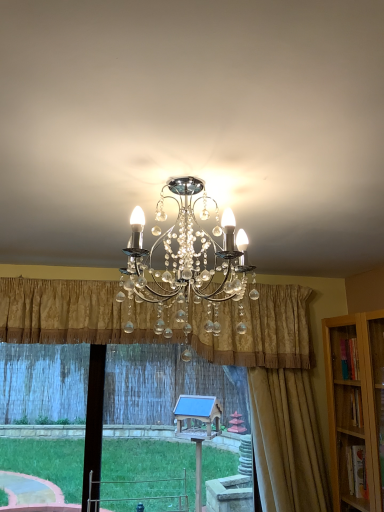
From the picture: In order to face transparent glass window at center, should I rotate leftwards or rightwards?

It's best to rotate left around 1.421 degrees.

This screenshot has height=512, width=384. What do you see at coordinates (167, 385) in the screenshot? I see `transparent glass window at center` at bounding box center [167, 385].

Identify the location of gold textured curtain at right, which ranks as the first curtain in right-to-left order. (285, 404).

The width and height of the screenshot is (384, 512). Identify the location of curtain located above the gold textured curtain at right, which ranks as the first curtain in right-to-left order (from a real-world perspective). (70, 313).

Would you consider gold textured curtain at right, which ranks as the first curtain in right-to-left order, to be distant from gold textured curtain at center, marked as the 2th curtain in a right-to-left arrangement?

No.

Which of these two, gold textured curtain at right, which ranks as the first curtain in right-to-left order, or gold textured curtain at center, positioned as the first curtain in left-to-right order, is smaller?

With smaller size is gold textured curtain at right, which ranks as the first curtain in right-to-left order.

Does gold textured curtain at right, which is the 2th curtain from left to right, turn towards gold textured curtain at center, marked as the 2th curtain in a right-to-left arrangement?

No, gold textured curtain at right, which is the 2th curtain from left to right, is not aimed at gold textured curtain at center, marked as the 2th curtain in a right-to-left arrangement.

Can you confirm if transparent glass window at center is taller than gold textured curtain at right, which ranks as the first curtain in right-to-left order?

In fact, transparent glass window at center may be shorter than gold textured curtain at right, which ranks as the first curtain in right-to-left order.

This screenshot has width=384, height=512. What are the coordinates of `the 1st curtain in front when counting from the transparent glass window at center` in the screenshot? It's located at (285, 404).

Based on the photo, from a real-world perspective, which object stands above the other?

gold textured curtain at right, which ranks as the first curtain in right-to-left order, from a real-world perspective.

Is gold textured curtain at right, which is the 2th curtain from left to right, aimed at transparent glass window at center?

No, gold textured curtain at right, which is the 2th curtain from left to right, is not oriented towards transparent glass window at center.

Consider the image. Is gold textured curtain at right, which is the 2th curtain from left to right, placed right next to transparent glass window at center?

No, gold textured curtain at right, which is the 2th curtain from left to right, is not making contact with transparent glass window at center.

How far apart are gold textured curtain at right, which ranks as the first curtain in right-to-left order, and transparent glass window at center?

A distance of 9.27 feet exists between gold textured curtain at right, which ranks as the first curtain in right-to-left order, and transparent glass window at center.

Is gold textured curtain at right, which is the 2th curtain from left to right, at the right side of transparent glass window at center?

Yes, gold textured curtain at right, which is the 2th curtain from left to right, is to the right of transparent glass window at center.

The width and height of the screenshot is (384, 512). Find the location of `curtain lying behind the gold textured curtain at center, positioned as the first curtain in left-to-right order`. curtain lying behind the gold textured curtain at center, positioned as the first curtain in left-to-right order is located at coordinates pyautogui.click(x=285, y=404).

Is gold textured curtain at center, positioned as the first curtain in left-to-right order, placed right next to gold textured curtain at right, which is the 2th curtain from left to right?

No, gold textured curtain at center, positioned as the first curtain in left-to-right order, is not beside gold textured curtain at right, which is the 2th curtain from left to right.

Is gold textured curtain at center, positioned as the first curtain in left-to-right order, inside the boundaries of gold textured curtain at right, which is the 2th curtain from left to right, or outside?

gold textured curtain at center, positioned as the first curtain in left-to-right order, is not inside gold textured curtain at right, which is the 2th curtain from left to right, it's outside.

In the scene shown: In the image, is gold textured curtain at center, marked as the 2th curtain in a right-to-left arrangement, on the left side or the right side of transparent glass window at center?

Clearly, gold textured curtain at center, marked as the 2th curtain in a right-to-left arrangement, is on the left of transparent glass window at center in the image.

Does gold textured curtain at center, marked as the 2th curtain in a right-to-left arrangement, lie behind transparent glass window at center?

No, it is not.

Is gold textured curtain at center, positioned as the first curtain in left-to-right order, wider or thinner than transparent glass window at center?

Clearly, gold textured curtain at center, positioned as the first curtain in left-to-right order, has more width compared to transparent glass window at center.

Does gold textured curtain at center, marked as the 2th curtain in a right-to-left arrangement, turn towards transparent glass window at center?

No, gold textured curtain at center, marked as the 2th curtain in a right-to-left arrangement, is not facing towards transparent glass window at center.

Is gold textured curtain at center, positioned as the first curtain in left-to-right order, at the back of transparent glass window at center?

No, transparent glass window at center is not facing away from gold textured curtain at center, positioned as the first curtain in left-to-right order.

Do you think transparent glass window at center is within gold textured curtain at center, marked as the 2th curtain in a right-to-left arrangement, or outside of it?

transparent glass window at center is not inside gold textured curtain at center, marked as the 2th curtain in a right-to-left arrangement, it's outside.

From a real-world perspective, is transparent glass window at center positioned above or below gold textured curtain at center, marked as the 2th curtain in a right-to-left arrangement?

transparent glass window at center is situated lower than gold textured curtain at center, marked as the 2th curtain in a right-to-left arrangement, in the real world.

Is transparent glass window at center far from gold textured curtain at center, marked as the 2th curtain in a right-to-left arrangement?

That's right, there is a large distance between transparent glass window at center and gold textured curtain at center, marked as the 2th curtain in a right-to-left arrangement.

I want to click on curtain lying on the left of gold textured curtain at right, which is the 2th curtain from left to right, so click(x=70, y=313).

This screenshot has width=384, height=512. I want to click on window frame below the gold textured curtain at right, which ranks as the first curtain in right-to-left order (from a real-world perspective), so click(167, 385).

Based on their spatial positions, is transparent glass window at center or gold textured curtain at right, which is the 2th curtain from left to right, further from gold textured curtain at center, positioned as the first curtain in left-to-right order?

transparent glass window at center.

Considering their positions, is gold textured curtain at right, which ranks as the first curtain in right-to-left order, positioned further to transparent glass window at center than gold textured curtain at center, marked as the 2th curtain in a right-to-left arrangement?

gold textured curtain at center, marked as the 2th curtain in a right-to-left arrangement.

Based on their spatial positions, is gold textured curtain at center, positioned as the first curtain in left-to-right order, or gold textured curtain at right, which ranks as the first curtain in right-to-left order, closer to transparent glass window at center?

gold textured curtain at right, which ranks as the first curtain in right-to-left order, is closer to transparent glass window at center.

Which object lies further to the anchor point gold textured curtain at right, which is the 2th curtain from left to right, gold textured curtain at center, marked as the 2th curtain in a right-to-left arrangement, or transparent glass window at center?

transparent glass window at center.

In the scene shown: Based on their spatial positions, is gold textured curtain at right, which is the 2th curtain from left to right, or transparent glass window at center closer to gold textured curtain at center, marked as the 2th curtain in a right-to-left arrangement?

Based on the image, gold textured curtain at right, which is the 2th curtain from left to right, appears to be nearer to gold textured curtain at center, marked as the 2th curtain in a right-to-left arrangement.

Based on the photo, when comparing their distances from gold textured curtain at right, which is the 2th curtain from left to right, does transparent glass window at center or gold textured curtain at center, marked as the 2th curtain in a right-to-left arrangement, seem closer?

gold textured curtain at center, marked as the 2th curtain in a right-to-left arrangement, is positioned closer to the anchor gold textured curtain at right, which is the 2th curtain from left to right.

The height and width of the screenshot is (512, 384). In order to click on window frame between gold textured curtain at center, marked as the 2th curtain in a right-to-left arrangement, and gold textured curtain at right, which ranks as the first curtain in right-to-left order, from left to right in this screenshot , I will do `click(167, 385)`.